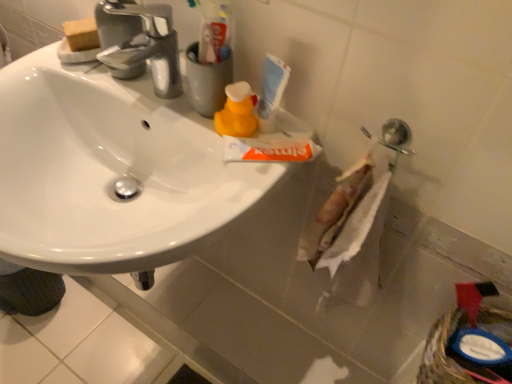
Question: Is the surface of yellow matte bottle at center in direct contact with blue plastic basket at lower right?

Choices:
 (A) yes
 (B) no

Answer: (B)

Question: Is yellow matte bottle at center not close to blue plastic basket at lower right?

Choices:
 (A) no
 (B) yes

Answer: (A)

Question: Is yellow matte bottle at center facing away from blue plastic basket at lower right?

Choices:
 (A) yes
 (B) no

Answer: (B)

Question: From the image's perspective, does yellow matte bottle at center appear higher than blue plastic basket at lower right?

Choices:
 (A) no
 (B) yes

Answer: (B)

Question: From a real-world perspective, is yellow matte bottle at center under blue plastic basket at lower right?

Choices:
 (A) yes
 (B) no

Answer: (B)

Question: From a real-world perspective, is blue plastic basket at lower right positioned above or below chrome metallic faucet at upper left?

Choices:
 (A) below
 (B) above

Answer: (A)

Question: Choose the correct answer: Is blue plastic basket at lower right inside chrome metallic faucet at upper left or outside it?

Choices:
 (A) outside
 (B) inside

Answer: (A)

Question: Is blue plastic basket at lower right taller or shorter than chrome metallic faucet at upper left?

Choices:
 (A) tall
 (B) short

Answer: (B)

Question: Is blue plastic basket at lower right wider or thinner than chrome metallic faucet at upper left?

Choices:
 (A) thin
 (B) wide

Answer: (A)

Question: Based on their positions, is yellow matte bottle at center located to the left or right of white glossy sink at upper left?

Choices:
 (A) left
 (B) right

Answer: (B)

Question: In terms of height, does yellow matte bottle at center look taller or shorter compared to white glossy sink at upper left?

Choices:
 (A) short
 (B) tall

Answer: (A)

Question: In terms of width, does yellow matte bottle at center look wider or thinner when compared to white glossy sink at upper left?

Choices:
 (A) thin
 (B) wide

Answer: (A)

Question: In the image, is yellow matte bottle at center positioned in front of or behind white glossy sink at upper left?

Choices:
 (A) front
 (B) behind

Answer: (B)

Question: In the image, is chrome metallic faucet at upper left positioned in front of or behind white plastic toothpaste tube at upper center?

Choices:
 (A) behind
 (B) front

Answer: (B)

Question: Is chrome metallic faucet at upper left wider or thinner than white plastic toothpaste tube at upper center?

Choices:
 (A) wide
 (B) thin

Answer: (A)